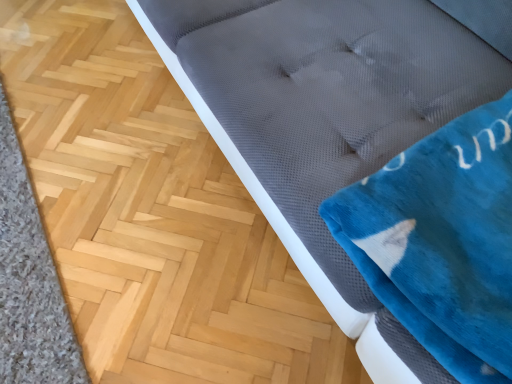
Question: From a real-world perspective, is gray carpet at lower left physically located above or below velvety blue blanket at upper right?

Choices:
 (A) above
 (B) below

Answer: (B)

Question: In the image, is gray carpet at lower left on the left side or the right side of velvety blue blanket at upper right?

Choices:
 (A) right
 (B) left

Answer: (B)

Question: Is gray carpet at lower left in front of or behind velvety blue blanket at upper right in the image?

Choices:
 (A) behind
 (B) front

Answer: (A)

Question: Considering the positions of velvety blue blanket at upper right and gray carpet at lower left in the image, is velvety blue blanket at upper right bigger or smaller than gray carpet at lower left?

Choices:
 (A) small
 (B) big

Answer: (B)

Question: Considering their positions, is velvety blue blanket at upper right located in front of or behind gray carpet at lower left?

Choices:
 (A) behind
 (B) front

Answer: (B)

Question: From a real-world perspective, is velvety blue blanket at upper right physically located above or below gray carpet at lower left?

Choices:
 (A) below
 (B) above

Answer: (B)

Question: From the image's perspective, is velvety blue blanket at upper right located above or below gray carpet at lower left?

Choices:
 (A) below
 (B) above

Answer: (B)